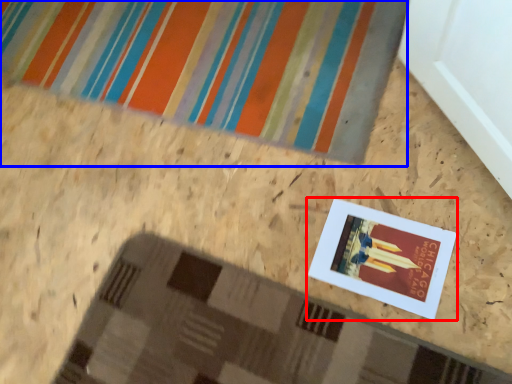
Question: Which object appears closest to the camera in this image, picture frame (highlighted by a red box) or bath mat (highlighted by a blue box)?

Choices:
 (A) picture frame
 (B) bath mat

Answer: (A)